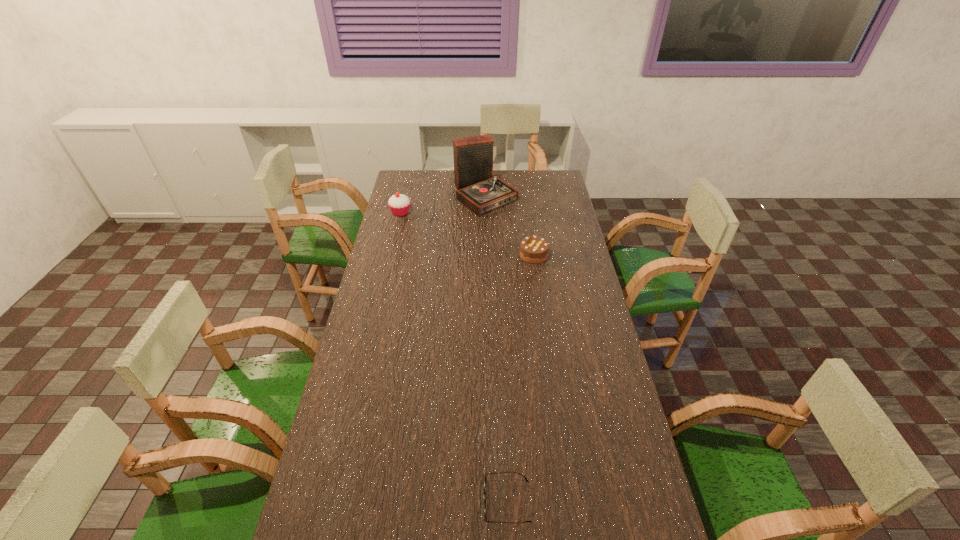
Where is `phonograph record`? This screenshot has width=960, height=540. phonograph record is located at coordinates [x=477, y=188].

Where is `the leftmost object`? The width and height of the screenshot is (960, 540). the leftmost object is located at coordinates (399, 204).

Identify the location of cupcake. This screenshot has height=540, width=960. (399, 204).

Image resolution: width=960 pixels, height=540 pixels. Identify the location of chocolate cake. (533, 249).

Find the location of a particular element. This screenshot has width=960, height=540. the second shortest object is located at coordinates (533, 249).

Where is `the shortest object`? This screenshot has height=540, width=960. the shortest object is located at coordinates (485, 501).

Where is `the nearest object`? the nearest object is located at coordinates (x=485, y=501).

Find the location of `vacant space located 0.300m on the left of the tallest object`. vacant space located 0.300m on the left of the tallest object is located at coordinates (393, 195).

Image resolution: width=960 pixels, height=540 pixels. Find the location of `vacant space located 0.260m on the back of the leftmost object`. vacant space located 0.260m on the back of the leftmost object is located at coordinates (409, 179).

Image resolution: width=960 pixels, height=540 pixels. Find the location of `vacant region located 0.340m on the back of the second nearest object`. vacant region located 0.340m on the back of the second nearest object is located at coordinates (526, 204).